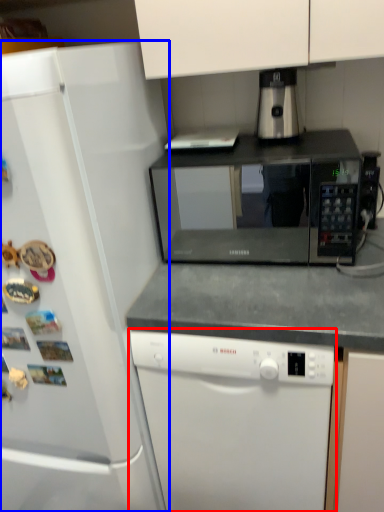
Question: Which object is further to the camera taking this photo, dishwasher (highlighted by a red box) or refrigerator (highlighted by a blue box)?

Choices:
 (A) dishwasher
 (B) refrigerator

Answer: (A)